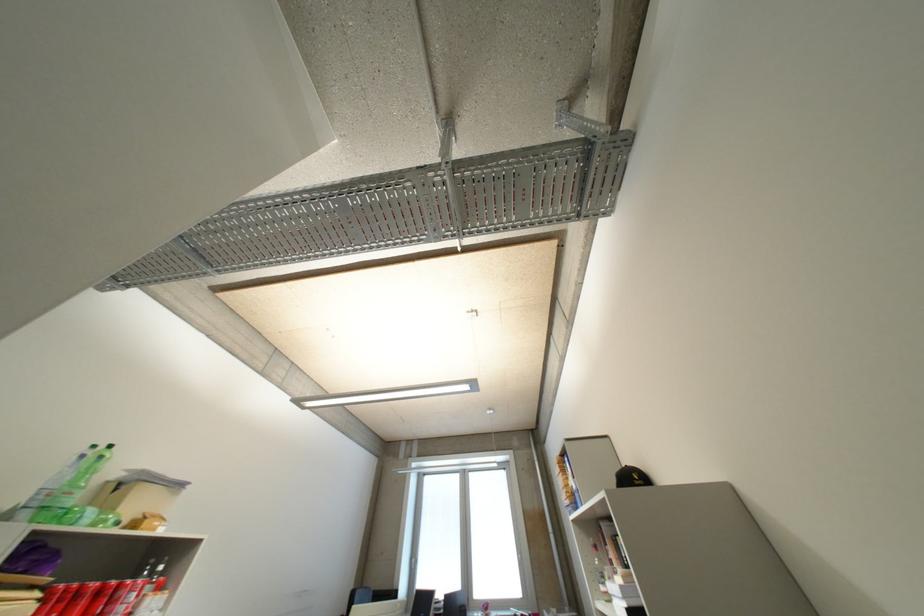
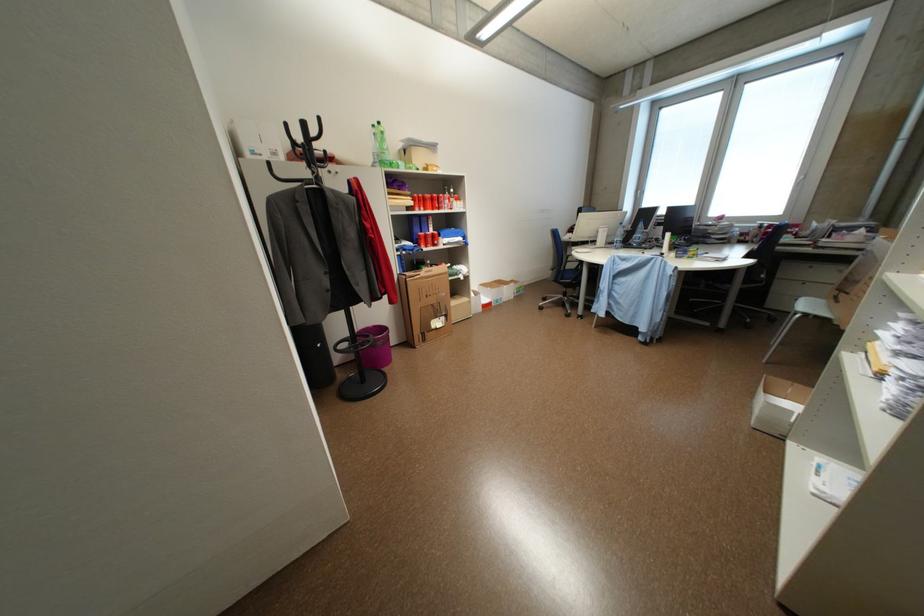
In the second image, find the point that corresponds to (103,448) in the first image.

(382, 127)